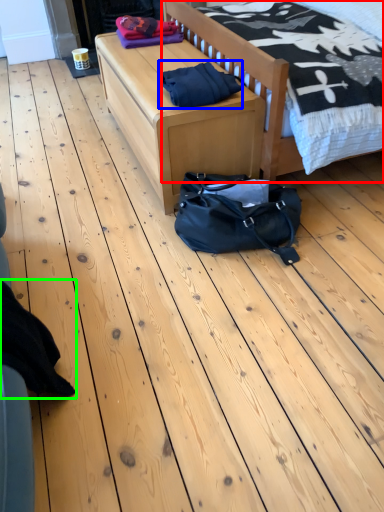
Question: Which object is the closest to the bed (highlighted by a red box)? Choose among these: material (highlighted by a blue box) or clothing (highlighted by a green box).

Choices:
 (A) material
 (B) clothing

Answer: (A)